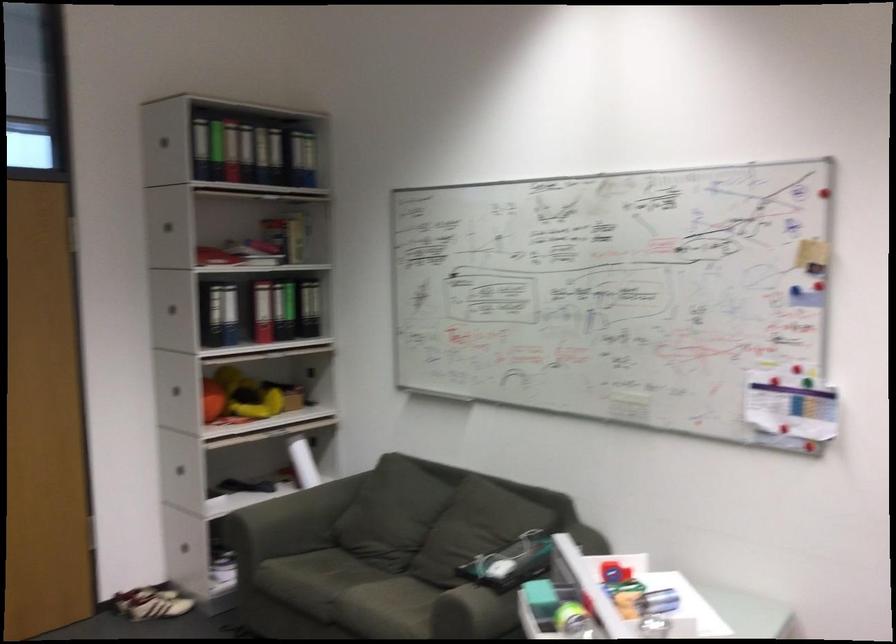
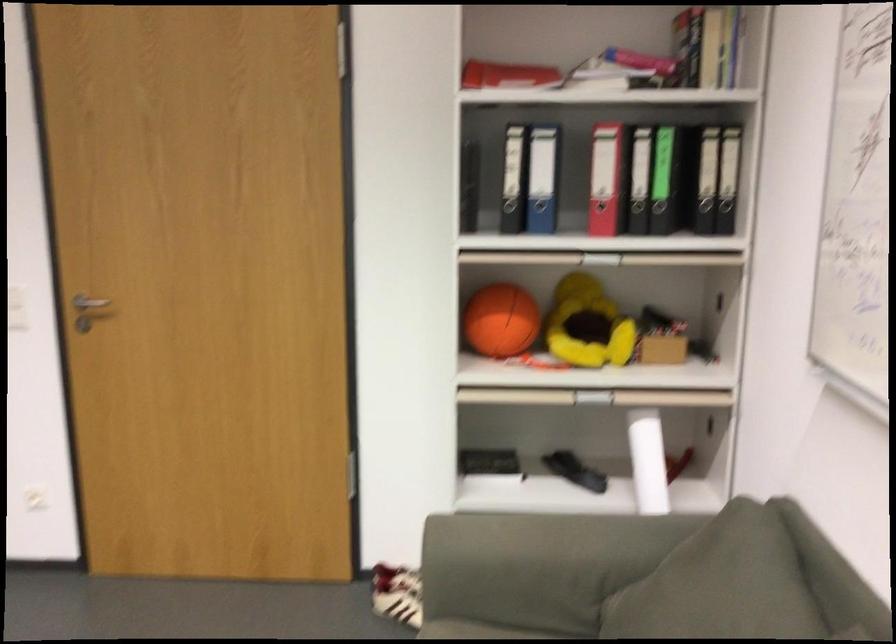
Find the pixel in the second image that matches [321,334] in the first image.

(734, 214)